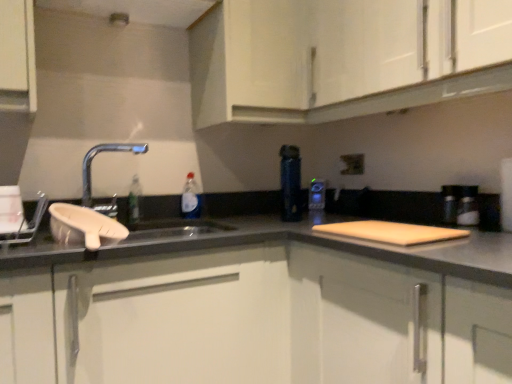
Where is `wooden cutting board at center, arranged as the 1th cabinetry when ordered from the bottom`? wooden cutting board at center, arranged as the 1th cabinetry when ordered from the bottom is located at coordinates (394, 323).

Identify the location of white matte cabinet at upper center, which is the 1th cabinetry in top-to-bottom order. (343, 57).

The image size is (512, 384). What do you see at coordinates (352, 164) in the screenshot?
I see `matte black electric outlet at upper center` at bounding box center [352, 164].

The width and height of the screenshot is (512, 384). What do you see at coordinates (317, 195) in the screenshot?
I see `blue glossy thermos at center` at bounding box center [317, 195].

What do you see at coordinates (190, 198) in the screenshot? I see `translucent plastic bottle at sink` at bounding box center [190, 198].

You are a GUI agent. You are given a task and a screenshot of the screen. Output one action in this format:
    pyautogui.click(x=<x>, y=<y>)
    Task: Click on the wooden cutting board at center, arranged as the 3th cabinetry when viewed from the top
    
    Given the screenshot: What is the action you would take?
    pyautogui.click(x=394, y=323)

Is translucent plastic bottle at sink oriented away from wooden cutting board at center, arranged as the 3th cabinetry when viewed from the top?

No, translucent plastic bottle at sink is not facing away from wooden cutting board at center, arranged as the 3th cabinetry when viewed from the top.

From the image's perspective, is translucent plastic bottle at sink located above or below wooden cutting board at center, arranged as the 1th cabinetry when ordered from the bottom?

translucent plastic bottle at sink is above wooden cutting board at center, arranged as the 1th cabinetry when ordered from the bottom.

Which object is more forward, translucent plastic bottle at sink or wooden cutting board at center, arranged as the 1th cabinetry when ordered from the bottom?

wooden cutting board at center, arranged as the 1th cabinetry when ordered from the bottom, is closer to the camera.

How far apart are translucent plastic bottle at sink and wooden cutting board at center, arranged as the 1th cabinetry when ordered from the bottom?

The distance of translucent plastic bottle at sink from wooden cutting board at center, arranged as the 1th cabinetry when ordered from the bottom, is 34.65 inches.

Identify the location of cabinetry that is the 1st object located below the translucent plastic bottle at sink (from the image's perspective). The image size is (512, 384). pos(176,318).

From a real-world perspective, who is located lower, white matte cabinet at lower center, the second cabinetry viewed from the top, or translucent plastic bottle at sink?

From a 3D spatial view, white matte cabinet at lower center, the second cabinetry viewed from the top, is below.

Would you consider white matte cabinet at lower center, acting as the 2th cabinetry starting from the bottom, to be distant from translucent plastic bottle at sink?

No.

Considering the sizes of objects white matte cabinet at lower center, acting as the 2th cabinetry starting from the bottom, and translucent plastic bottle at sink in the image provided, who is smaller, white matte cabinet at lower center, acting as the 2th cabinetry starting from the bottom, or translucent plastic bottle at sink?

translucent plastic bottle at sink.

Is white matte cabinet at upper center, which is the 1th cabinetry in top-to-bottom order, in contact with matte black electric outlet at upper center?

white matte cabinet at upper center, which is the 1th cabinetry in top-to-bottom order, and matte black electric outlet at upper center are clearly separated.

Considering the relative positions of white matte cabinet at upper center, which is counted as the third cabinetry, starting from the bottom, and matte black electric outlet at upper center in the image provided, is white matte cabinet at upper center, which is counted as the third cabinetry, starting from the bottom, behind matte black electric outlet at upper center?

That is False.

From a real-world perspective, who is located lower, white matte cabinet at upper center, which is the 1th cabinetry in top-to-bottom order, or matte black electric outlet at upper center?

In real-world perspective, matte black electric outlet at upper center is lower.

Would you say white matte cabinet at lower center, the second cabinetry viewed from the top, is to the left or to the right of wooden cutting board at center, arranged as the 3th cabinetry when viewed from the top, in the picture?

Based on their positions, white matte cabinet at lower center, the second cabinetry viewed from the top, is located to the left of wooden cutting board at center, arranged as the 3th cabinetry when viewed from the top.

Is white matte cabinet at lower center, the second cabinetry viewed from the top, outside of wooden cutting board at center, arranged as the 1th cabinetry when ordered from the bottom?

Yes, white matte cabinet at lower center, the second cabinetry viewed from the top, is not within wooden cutting board at center, arranged as the 1th cabinetry when ordered from the bottom.

Is white matte cabinet at lower center, acting as the 2th cabinetry starting from the bottom, looking in the opposite direction of wooden cutting board at center, arranged as the 1th cabinetry when ordered from the bottom?

Correct, white matte cabinet at lower center, acting as the 2th cabinetry starting from the bottom, is looking away from wooden cutting board at center, arranged as the 1th cabinetry when ordered from the bottom.

Between point (214, 273) and point (386, 360), which one is positioned behind?

Positioned behind is point (214, 273).

From a real-world perspective, which is physically above, blue glossy thermos at center or white matte cabinet at lower center, the second cabinetry viewed from the top?

blue glossy thermos at center, from a real-world perspective.

Is blue glossy thermos at center turned away from white matte cabinet at lower center, acting as the 2th cabinetry starting from the bottom?

No, blue glossy thermos at center is not facing away from white matte cabinet at lower center, acting as the 2th cabinetry starting from the bottom.

Can you see blue glossy thermos at center touching white matte cabinet at lower center, acting as the 2th cabinetry starting from the bottom?

blue glossy thermos at center and white matte cabinet at lower center, acting as the 2th cabinetry starting from the bottom, are clearly separated.

Is blue glossy thermos at center situated inside white matte cabinet at lower center, acting as the 2th cabinetry starting from the bottom, or outside?

blue glossy thermos at center lies outside white matte cabinet at lower center, acting as the 2th cabinetry starting from the bottom.

Consider the image. Is wooden cutting board at center, arranged as the 3th cabinetry when viewed from the top, looking in the opposite direction of matte black electric outlet at upper center?

No, matte black electric outlet at upper center is not at the back of wooden cutting board at center, arranged as the 3th cabinetry when viewed from the top.

Is wooden cutting board at center, arranged as the 3th cabinetry when viewed from the top, positioned beyond the bounds of matte black electric outlet at upper center?

Indeed, wooden cutting board at center, arranged as the 3th cabinetry when viewed from the top, is completely outside matte black electric outlet at upper center.

Between point (298, 343) and point (355, 167), which one is positioned behind?

The point (355, 167) is behind.

Which of these two, wooden cutting board at center, arranged as the 1th cabinetry when ordered from the bottom, or matte black electric outlet at upper center, stands shorter?

matte black electric outlet at upper center is shorter.

Is point (302, 273) closer to viewer compared to point (312, 188)?

That is True.

Is wooden cutting board at center, arranged as the 1th cabinetry when ordered from the bottom, taller or shorter than blue glossy thermos at center?

In the image, wooden cutting board at center, arranged as the 1th cabinetry when ordered from the bottom, appears to be taller than blue glossy thermos at center.

In the image, there is a wooden cutting board at center, arranged as the 1th cabinetry when ordered from the bottom. Identify the location of bottle above it (from the image's perspective). The width and height of the screenshot is (512, 384). (190, 198).

Find the location of a particular element. Image resolution: width=512 pixels, height=384 pixels. the 1st cabinetry below the translucent plastic bottle at sink (from the image's perspective) is located at coordinates (176, 318).

Considering their positions, is wooden cutting board at center, arranged as the 1th cabinetry when ordered from the bottom, positioned further to translucent plastic bottle at sink than blue glossy thermos at center?

wooden cutting board at center, arranged as the 1th cabinetry when ordered from the bottom, is positioned further to the anchor translucent plastic bottle at sink.

When comparing their distances from wooden cutting board at center, arranged as the 3th cabinetry when viewed from the top, does white matte cabinet at upper center, which is the 1th cabinetry in top-to-bottom order, or blue glossy thermos at center seem further?

The object further to wooden cutting board at center, arranged as the 3th cabinetry when viewed from the top, is blue glossy thermos at center.

When comparing their distances from white matte cabinet at lower center, acting as the 2th cabinetry starting from the bottom, does blue glossy thermos at center or wooden cutting board at center, arranged as the 1th cabinetry when ordered from the bottom, seem further?

Based on the image, blue glossy thermos at center appears to be further to white matte cabinet at lower center, acting as the 2th cabinetry starting from the bottom.

Estimate the real-world distances between objects in this image. Which object is closer to blue glossy thermos at center, matte black electric outlet at upper center or wooden cutting board at center, arranged as the 3th cabinetry when viewed from the top?

matte black electric outlet at upper center.

Considering their positions, is light brown wood cutting board at right positioned further to white matte cabinet at upper center, which is the 1th cabinetry in top-to-bottom order, than white matte cabinet at lower center, acting as the 2th cabinetry starting from the bottom?

Among the two, white matte cabinet at lower center, acting as the 2th cabinetry starting from the bottom, is located further to white matte cabinet at upper center, which is the 1th cabinetry in top-to-bottom order.

When comparing their distances from wooden cutting board at center, arranged as the 3th cabinetry when viewed from the top, does white matte cabinet at lower center, the second cabinetry viewed from the top, or matte black electric outlet at upper center seem closer?

Among the two, white matte cabinet at lower center, the second cabinetry viewed from the top, is located nearer to wooden cutting board at center, arranged as the 3th cabinetry when viewed from the top.

Estimate the real-world distances between objects in this image. Which object is further from light brown wood cutting board at right, wooden cutting board at center, arranged as the 3th cabinetry when viewed from the top, or translucent plastic bottle at sink?

translucent plastic bottle at sink lies further to light brown wood cutting board at right than the other object.

Estimate the real-world distances between objects in this image. Which object is closer to wooden cutting board at center, arranged as the 3th cabinetry when viewed from the top, white matte cabinet at lower center, acting as the 2th cabinetry starting from the bottom, or white matte cabinet at upper center, which is the 1th cabinetry in top-to-bottom order?

white matte cabinet at lower center, acting as the 2th cabinetry starting from the bottom.

Locate an element on the screen. electric outlet between white matte cabinet at upper center, which is the 1th cabinetry in top-to-bottom order, and blue glossy thermos at center from front to back is located at coordinates (352, 164).

Find the location of a particular element. cutting board located between wooden cutting board at center, arranged as the 3th cabinetry when viewed from the top, and translucent plastic bottle at sink in the depth direction is located at coordinates (392, 232).

This screenshot has height=384, width=512. I want to click on bottle between light brown wood cutting board at right and blue glossy thermos at center from front to back, so click(190, 198).

Identify the location of electric outlet located between wooden cutting board at center, arranged as the 1th cabinetry when ordered from the bottom, and blue glossy thermos at center in the depth direction. (352, 164).